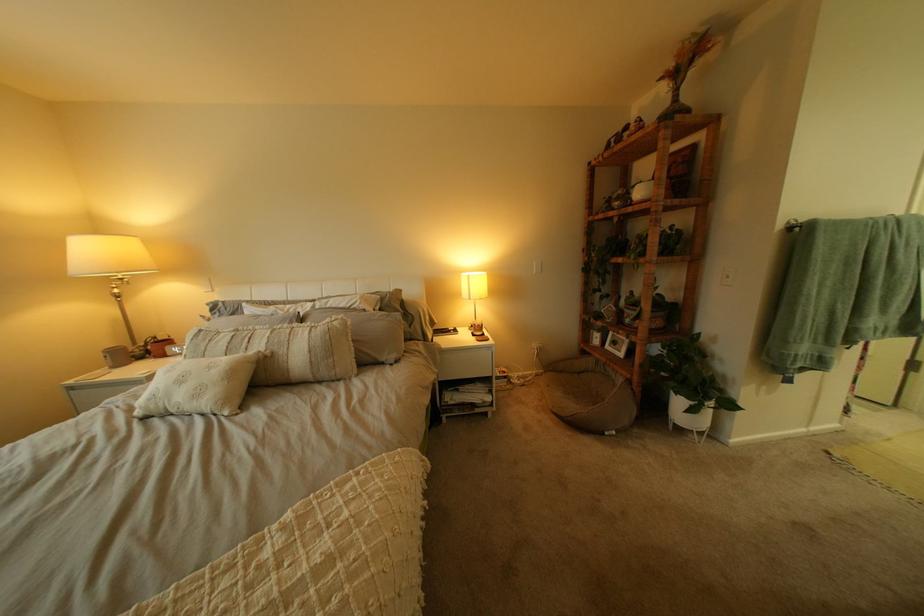
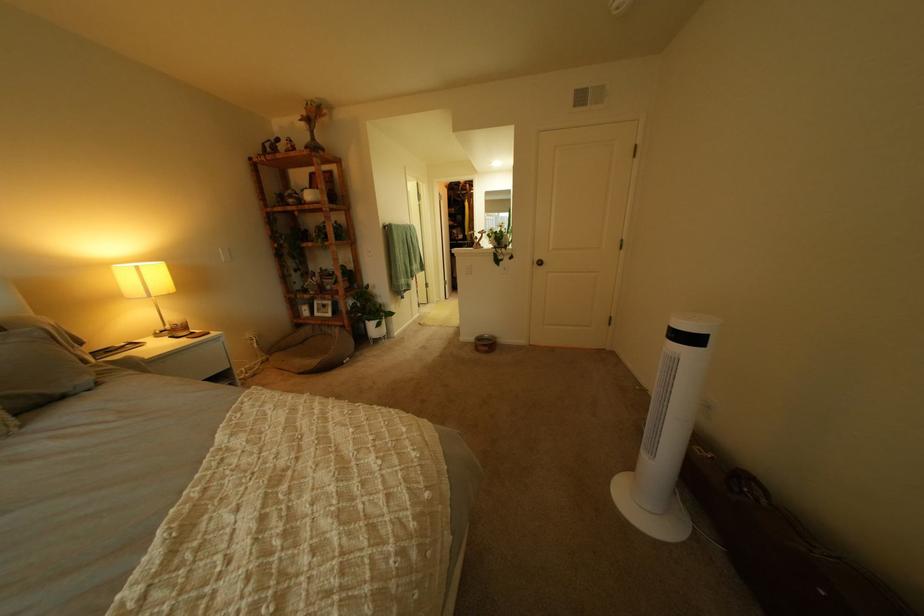
Where in the second image is the point corresponding to (x=412, y=363) from the first image?

(115, 385)